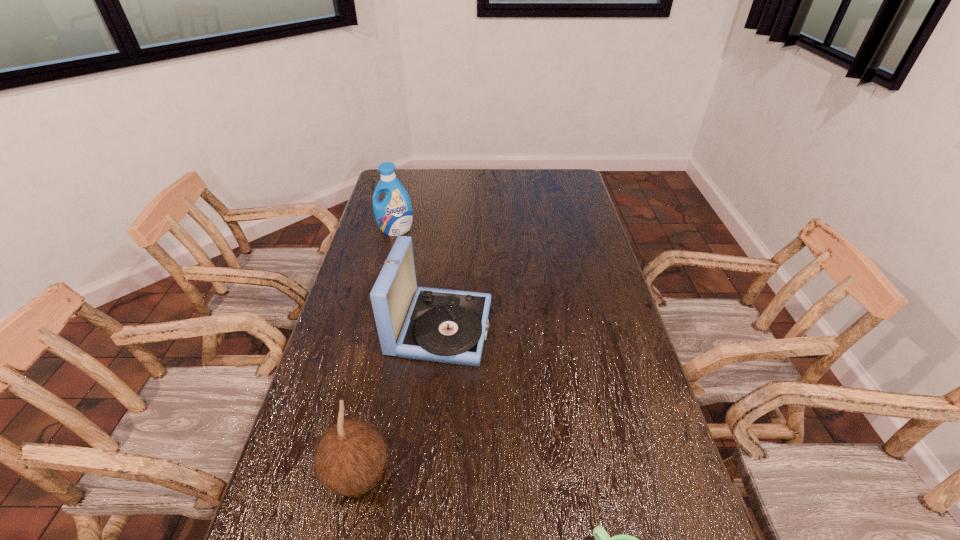
In the image, there is a desktop. Where is `vacant space at the right edge`? The width and height of the screenshot is (960, 540). vacant space at the right edge is located at coordinates (630, 370).

The height and width of the screenshot is (540, 960). In the image, there is a desktop. In order to click on vacant space at the far right corner in this screenshot , I will do pyautogui.click(x=549, y=168).

Find the location of a particular element. free area in between the detergent and the third nearest object is located at coordinates (419, 279).

Locate an element on the screen. The image size is (960, 540). free space between the third nearest object and the detergent is located at coordinates (419, 279).

I want to click on vacant space in between the coconut and the phonograph record, so click(x=398, y=401).

At what (x,y) coordinates should I click in order to perform the action: click on vacant space that's between the detergent and the coconut. Please return your answer as a coordinate pair (x, y). Looking at the image, I should click on (376, 352).

You are a GUI agent. You are given a task and a screenshot of the screen. Output one action in this format:
    pyautogui.click(x=<x>, y=<y>)
    Task: Click on the free space between the farthest object and the second nearest object
    Image resolution: width=960 pixels, height=540 pixels.
    Given the screenshot: What is the action you would take?
    pyautogui.click(x=376, y=352)

You are a GUI agent. You are given a task and a screenshot of the screen. Output one action in this format:
    pyautogui.click(x=<x>, y=<y>)
    Task: Click on the object that is the third closest to the farthest object
    The height and width of the screenshot is (540, 960).
    Given the screenshot: What is the action you would take?
    pyautogui.click(x=602, y=538)

Choose which object is the third nearest neighbor to the second nearest object. Please provide its 2D coordinates. Your answer should be formatted as a tuple, i.e. [(x, y)], where the tuple contains the x and y coordinates of a point satisfying the conditions above.

[(394, 215)]

Identify the location of vacant region that satisfies the following two spatial constraints: 1. on the front-facing side of the detergent; 2. on the left side of the phonograph record. This screenshot has width=960, height=540. pos(372,328).